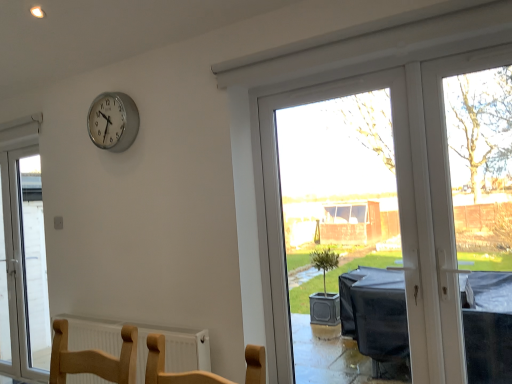
Question: Is white textured radiator at lower center not close to transparent plastic window at center, the second window viewed from the back?

Choices:
 (A) no
 (B) yes

Answer: (B)

Question: Is white textured radiator at lower center in contact with transparent plastic window at center, acting as the 1th window starting from the right?

Choices:
 (A) no
 (B) yes

Answer: (A)

Question: Considering the relative positions of white textured radiator at lower center and transparent plastic window at center, which appears as the 1th window when viewed from the front, in the image provided, is white textured radiator at lower center to the left of transparent plastic window at center, which appears as the 1th window when viewed from the front, from the viewer's perspective?

Choices:
 (A) yes
 (B) no

Answer: (A)

Question: Can you confirm if white textured radiator at lower center is wider than transparent plastic window at center, the second window viewed from the back?

Choices:
 (A) yes
 (B) no

Answer: (A)

Question: Can you confirm if white textured radiator at lower center is taller than transparent plastic window at center, acting as the 1th window starting from the right?

Choices:
 (A) yes
 (B) no

Answer: (B)

Question: From the image's perspective, is white glass door at left, which is counted as the first window, starting from the back, above or below silver metallic clock at upper left?

Choices:
 (A) above
 (B) below

Answer: (B)

Question: Is white glass door at left, acting as the second window starting from the front, wider or thinner than silver metallic clock at upper left?

Choices:
 (A) wide
 (B) thin

Answer: (A)

Question: Considering their positions, is white glass door at left, the second window from the right, located in front of or behind silver metallic clock at upper left?

Choices:
 (A) behind
 (B) front

Answer: (A)

Question: Is white glass door at left, the second window from the right, inside the boundaries of silver metallic clock at upper left, or outside?

Choices:
 (A) outside
 (B) inside

Answer: (A)

Question: Choose the correct answer: Is white glass door at left, which is counted as the first window, starting from the back, inside white textured radiator at lower center or outside it?

Choices:
 (A) inside
 (B) outside

Answer: (B)

Question: From a real-world perspective, relative to white textured radiator at lower center, is white glass door at left, acting as the second window starting from the front, vertically above or below?

Choices:
 (A) above
 (B) below

Answer: (A)

Question: Considering the positions of white glass door at left, the second window from the right, and white textured radiator at lower center in the image, is white glass door at left, the second window from the right, wider or thinner than white textured radiator at lower center?

Choices:
 (A) wide
 (B) thin

Answer: (A)

Question: Is point tap(41, 273) closer or farther from the camera than point tap(177, 337)?

Choices:
 (A) closer
 (B) farther

Answer: (B)

Question: Would you say white textured radiator at lower center is inside or outside white glass door at left, the second window from the right?

Choices:
 (A) outside
 (B) inside

Answer: (A)

Question: From a real-world perspective, is white textured radiator at lower center above or below white glass door at left, the second window from the right?

Choices:
 (A) below
 (B) above

Answer: (A)